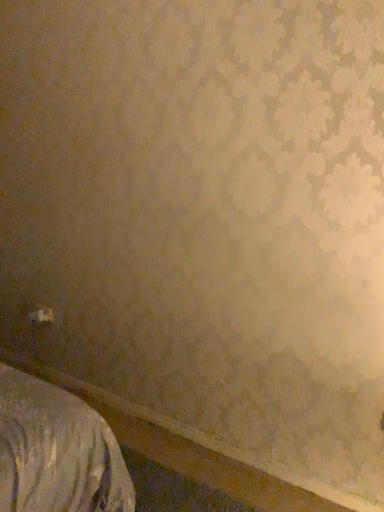
What do you see at coordinates (41, 315) in the screenshot?
I see `white matte electric outlet at lower left` at bounding box center [41, 315].

The image size is (384, 512). Find the location of `white matte electric outlet at lower left`. white matte electric outlet at lower left is located at coordinates (41, 315).

Identify the location of white matte electric outlet at lower left. (41, 315).